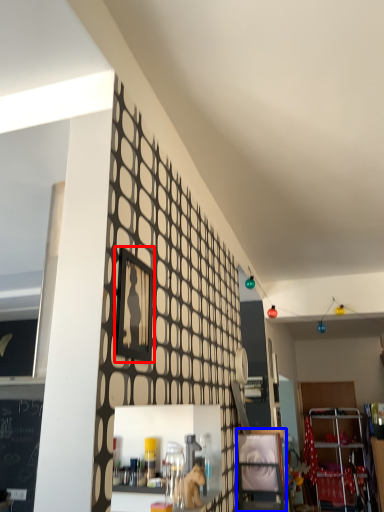
Question: Which of the following is the farthest to the observer, picture frame (highlighted by a red box) or shelf (highlighted by a blue box)?

Choices:
 (A) picture frame
 (B) shelf

Answer: (B)